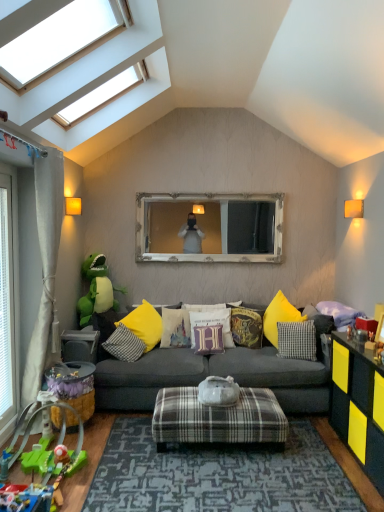
Question: From the image's perspective, is matte gray table at lower left above white cotton pillow at center, which appears as the 5th pillow when viewed from the right?

Choices:
 (A) yes
 (B) no

Answer: (B)

Question: Does matte gray table at lower left come behind white cotton pillow at center, which appears as the 5th pillow when viewed from the right?

Choices:
 (A) yes
 (B) no

Answer: (B)

Question: Is white cotton pillow at center, acting as the 2th pillow starting from the left, inside matte gray table at lower left?

Choices:
 (A) yes
 (B) no

Answer: (B)

Question: Is matte gray table at lower left looking in the opposite direction of white cotton pillow at center, acting as the 2th pillow starting from the left?

Choices:
 (A) yes
 (B) no

Answer: (B)

Question: Does matte gray table at lower left have a larger size compared to white cotton pillow at center, which appears as the 5th pillow when viewed from the right?

Choices:
 (A) no
 (B) yes

Answer: (A)

Question: Looking at their shapes, would you say dark gray fabric couch at center is wider or thinner than plastic toy car at lower left, the 1th toy positioned from the front?

Choices:
 (A) thin
 (B) wide

Answer: (B)

Question: Visually, is dark gray fabric couch at center positioned to the left or to the right of plastic toy car at lower left, the 1th toy positioned from the front?

Choices:
 (A) left
 (B) right

Answer: (B)

Question: In terms of height, does dark gray fabric couch at center look taller or shorter compared to plastic toy car at lower left, the 1th toy positioned from the front?

Choices:
 (A) tall
 (B) short

Answer: (A)

Question: From a real-world perspective, is dark gray fabric couch at center positioned above or below plastic toy car at lower left, the 4th toy viewed from the back?

Choices:
 (A) above
 (B) below

Answer: (A)

Question: Is green plastic toy at lower left, which is the 1th toy in bottom-to-top order, in front of or behind beige fabric curtain at left in the image?

Choices:
 (A) front
 (B) behind

Answer: (A)

Question: Is green plastic toy at lower left, placed as the second toy when sorted from front to back, taller or shorter than beige fabric curtain at left?

Choices:
 (A) tall
 (B) short

Answer: (B)

Question: From a real-world perspective, is green plastic toy at lower left, which is the 1th toy in bottom-to-top order, positioned above or below beige fabric curtain at left?

Choices:
 (A) below
 (B) above

Answer: (A)

Question: Is green plastic toy at lower left, placed as the second toy when sorted from front to back, spatially inside beige fabric curtain at left, or outside of it?

Choices:
 (A) inside
 (B) outside

Answer: (B)

Question: From a real-world perspective, is transparent glass skylight at upper left positioned above or below green plastic toy at lower left, which is the 1th toy in bottom-to-top order?

Choices:
 (A) above
 (B) below

Answer: (A)

Question: Would you say transparent glass skylight at upper left is to the left or to the right of green plastic toy at lower left, which is the 1th toy in bottom-to-top order, in the picture?

Choices:
 (A) right
 (B) left

Answer: (A)